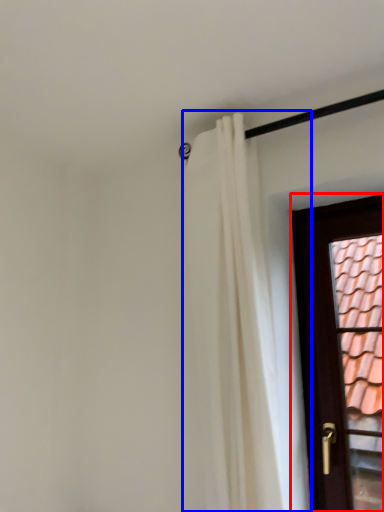
Question: Among these objects, which one is farthest to the camera, door (highlighted by a red box) or curtain (highlighted by a blue box)?

Choices:
 (A) door
 (B) curtain

Answer: (A)